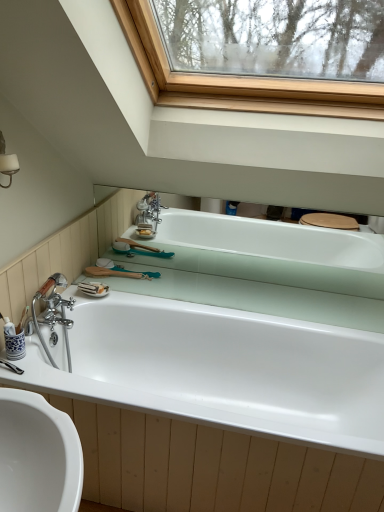
Question: In terms of size, does white glossy bathtub at center, the first bathtub from the bottom, appear bigger or smaller than white glossy bathtub at center, which is the second bathtub in bottom-to-top order?

Choices:
 (A) big
 (B) small

Answer: (A)

Question: From the image's perspective, is white glossy bathtub at center, the 2th bathtub in the top-to-bottom sequence, above or below white glossy bathtub at center, which is the second bathtub in bottom-to-top order?

Choices:
 (A) above
 (B) below

Answer: (B)

Question: From a real-world perspective, is white glossy bathtub at center, the 2th bathtub in the top-to-bottom sequence, physically located above or below white glossy bathtub at center, which is the second bathtub in bottom-to-top order?

Choices:
 (A) above
 (B) below

Answer: (B)

Question: Is point (359, 285) closer or farther from the camera than point (309, 326)?

Choices:
 (A) farther
 (B) closer

Answer: (A)

Question: Is white glossy bathtub at center, which is the second bathtub in bottom-to-top order, taller or shorter than white glossy bathtub at center, the first bathtub from the bottom?

Choices:
 (A) short
 (B) tall

Answer: (A)

Question: Would you say white glossy bathtub at center, which is the first bathtub in top-to-bottom order, is to the left or to the right of white glossy bathtub at center, the 2th bathtub in the top-to-bottom sequence, in the picture?

Choices:
 (A) right
 (B) left

Answer: (A)

Question: Based on their sizes in the image, would you say white glossy bathtub at center, which is the first bathtub in top-to-bottom order, is bigger or smaller than white glossy bathtub at center, the 2th bathtub in the top-to-bottom sequence?

Choices:
 (A) small
 (B) big

Answer: (A)